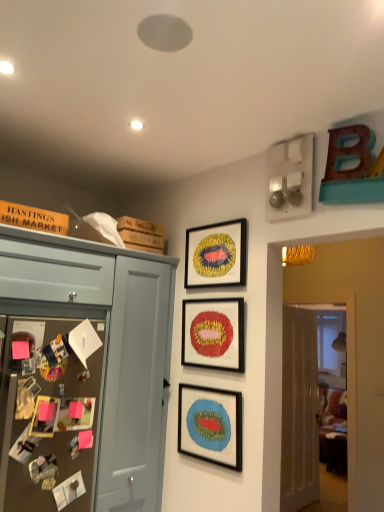
Describe the element at coordinates (299, 410) in the screenshot. I see `white glossy door at right` at that location.

Identify the location of matte blue cabinet at left. The width and height of the screenshot is (384, 512). (81, 373).

Measure the distance between point (82, 265) and camera.

Point (82, 265) is 7.40 feet from camera.

How much space does matte red picture frame at center, the 2th picture frame when ordered from top to bottom, occupy vertically?

matte red picture frame at center, the 2th picture frame when ordered from top to bottom, is 14.78 inches in height.

What is the approximate width of gold textured frame at upper center, which is the third picture frame in bottom-to-top order?

gold textured frame at upper center, which is the third picture frame in bottom-to-top order, is 4.23 centimeters in width.

Where is `gold textured frame at upper center, which is the third picture frame in bottom-to-top order`? The height and width of the screenshot is (512, 384). gold textured frame at upper center, which is the third picture frame in bottom-to-top order is located at coordinates (216, 255).

The height and width of the screenshot is (512, 384). Find the location of `matte black picture frame at center, the 1th picture frame from the bottom`. matte black picture frame at center, the 1th picture frame from the bottom is located at coordinates (210, 425).

Which is closer, (x=318, y=471) or (x=58, y=267)?

Point (x=318, y=471) is farther from the camera than point (x=58, y=267).

Is white glossy door at right shorter than matte blue cabinet at left?

Incorrect, the height of white glossy door at right does not fall short of that of matte blue cabinet at left.

Find the location of a particular element. The image size is (384, 512). drawer above the white glossy door at right (from the image's perspective) is located at coordinates (54, 274).

Between point (65, 249) and point (232, 237), which one is positioned behind?

The point (232, 237) is farther from the camera.

Considering the sizes of objects matte blue cabinet at left and gold textured frame at upper center, placed as the first picture frame when sorted from top to bottom, in the image provided, who is smaller, matte blue cabinet at left or gold textured frame at upper center, placed as the first picture frame when sorted from top to bottom,?

gold textured frame at upper center, placed as the first picture frame when sorted from top to bottom.

From the image's perspective, is matte blue cabinet at left below gold textured frame at upper center, placed as the first picture frame when sorted from top to bottom?

Yes, from the image's perspective, matte blue cabinet at left is below gold textured frame at upper center, placed as the first picture frame when sorted from top to bottom.

Based on the photo, is matte blue cabinet at left surrounding gold textured frame at upper center, placed as the first picture frame when sorted from top to bottom?

No.

Can you confirm if matte blue cabinet at left is positioned to the right of matte blue cabinet at left?

Indeed, matte blue cabinet at left is positioned on the right side of matte blue cabinet at left.

From the image's perspective, is matte blue cabinet at left positioned above or below matte blue cabinet at left?

Clearly, from the image's perspective, matte blue cabinet at left is below matte blue cabinet at left.

Between matte blue cabinet at left and matte blue cabinet at left, which one has smaller width?

With smaller width is matte blue cabinet at left.

Can you confirm if white glossy door at right is wider than matte red picture frame at center, the 2th picture frame when ordered from top to bottom?

Yes, white glossy door at right is wider than matte red picture frame at center, the 2th picture frame when ordered from top to bottom.

Does white glossy door at right contain matte red picture frame at center, which appears as the second picture frame when ordered from the bottom?

No, matte red picture frame at center, which appears as the second picture frame when ordered from the bottom, is located outside of white glossy door at right.

Does white glossy door at right have a greater height compared to matte red picture frame at center, the 2th picture frame when ordered from top to bottom?

Indeed, white glossy door at right has a greater height compared to matte red picture frame at center, the 2th picture frame when ordered from top to bottom.

Would you consider white glossy door at right to be distant from matte red picture frame at center, the 2th picture frame when ordered from top to bottom?

Yes, white glossy door at right and matte red picture frame at center, the 2th picture frame when ordered from top to bottom, are located far from each other.

Between point (237, 264) and point (204, 362), which one is positioned behind?

The point (204, 362) is farther from the camera.

Between gold textured frame at upper center, placed as the first picture frame when sorted from top to bottom, and matte red picture frame at center, which appears as the second picture frame when ordered from the bottom, which one has larger size?

With larger size is matte red picture frame at center, which appears as the second picture frame when ordered from the bottom.

Which object is further away from the camera, gold textured frame at upper center, which is the third picture frame in bottom-to-top order, or matte red picture frame at center, the 2th picture frame when ordered from top to bottom?

gold textured frame at upper center, which is the third picture frame in bottom-to-top order, is further from the camera.

Considering the sizes of objects matte blue cabinet at left and brown textured bulletin board at left in the image provided, who is taller, matte blue cabinet at left or brown textured bulletin board at left?

Standing taller between the two is matte blue cabinet at left.

Does matte blue cabinet at left have a greater width compared to brown textured bulletin board at left?

Indeed, matte blue cabinet at left has a greater width compared to brown textured bulletin board at left.

From the image's perspective, who appears lower, matte blue cabinet at left or brown textured bulletin board at left?

matte blue cabinet at left.

Is matte blue cabinet at left beside brown textured bulletin board at left?

Yes.

Is matte blue cabinet at left oriented away from matte blue cabinet at left?

That's not correct — matte blue cabinet at left is not looking away from matte blue cabinet at left.

From a real-world perspective, is matte blue cabinet at left over matte blue cabinet at left?

Correct, in the physical world, matte blue cabinet at left is higher than matte blue cabinet at left.

Which of these two, matte blue cabinet at left or matte blue cabinet at left, is wider?

Wider between the two is matte blue cabinet at left.

This screenshot has height=512, width=384. I want to click on door below the matte blue cabinet at left (from a real-world perspective), so click(x=299, y=410).

Locate an element on the screen. This screenshot has width=384, height=512. the 3rd picture frame counting from the right of the matte blue cabinet at left is located at coordinates (216, 255).

When comparing their distances from matte blue cabinet at left, does matte red picture frame at center, the 2th picture frame when ordered from top to bottom, or matte blue cabinet at left seem further?

matte red picture frame at center, the 2th picture frame when ordered from top to bottom, is further to matte blue cabinet at left.

Considering their positions, is matte black picture frame at center, the 1th picture frame from the bottom, positioned closer to matte blue cabinet at left than white glossy door at right?

matte black picture frame at center, the 1th picture frame from the bottom, is closer to matte blue cabinet at left.

Looking at this image, based on their spatial positions, is brown textured bulletin board at left or matte blue cabinet at left further from matte red picture frame at center, the 2th picture frame when ordered from top to bottom?

brown textured bulletin board at left.

Looking at this image, based on their spatial positions, is matte blue cabinet at left or matte blue cabinet at left further from matte black picture frame at center, the 1th picture frame from the bottom?

Based on the image, matte blue cabinet at left appears to be further to matte black picture frame at center, the 1th picture frame from the bottom.

Which object lies further to the anchor point matte blue cabinet at left, matte black picture frame at center, the third picture frame viewed from the top, or brown textured bulletin board at left?

The object further to matte blue cabinet at left is matte black picture frame at center, the third picture frame viewed from the top.

Estimate the real-world distances between objects in this image. Which object is closer to matte blue cabinet at left, matte red picture frame at center, the 2th picture frame when ordered from top to bottom, or matte blue cabinet at left?

matte blue cabinet at left.

From the picture: Looking at the image, which one is located further to matte blue cabinet at left, matte red picture frame at center, which appears as the second picture frame when ordered from the bottom, or brown textured bulletin board at left?

Among the two, matte red picture frame at center, which appears as the second picture frame when ordered from the bottom, is located further to matte blue cabinet at left.

Considering their positions, is matte red picture frame at center, which appears as the second picture frame when ordered from the bottom, positioned closer to gold textured frame at upper center, placed as the first picture frame when sorted from top to bottom, than white glossy door at right?

Based on the image, matte red picture frame at center, which appears as the second picture frame when ordered from the bottom, appears to be nearer to gold textured frame at upper center, placed as the first picture frame when sorted from top to bottom.

Find the location of a particular element. picture frame between gold textured frame at upper center, placed as the first picture frame when sorted from top to bottom, and matte blue cabinet at left in the up-down direction is located at coordinates (213, 333).

This screenshot has width=384, height=512. Identify the location of picture frame between matte blue cabinet at left and matte red picture frame at center, the 2th picture frame when ordered from top to bottom. (210, 425).

Find the location of `cabinetry between matte blue cabinet at left and matte black picture frame at center, the 1th picture frame from the bottom`. cabinetry between matte blue cabinet at left and matte black picture frame at center, the 1th picture frame from the bottom is located at coordinates (81, 373).

At what (x,y) coordinates should I click in order to perform the action: click on cabinetry between matte blue cabinet at left and matte red picture frame at center, the 2th picture frame when ordered from top to bottom. Please return your answer as a coordinate pair (x, y). Looking at the image, I should click on (81, 373).